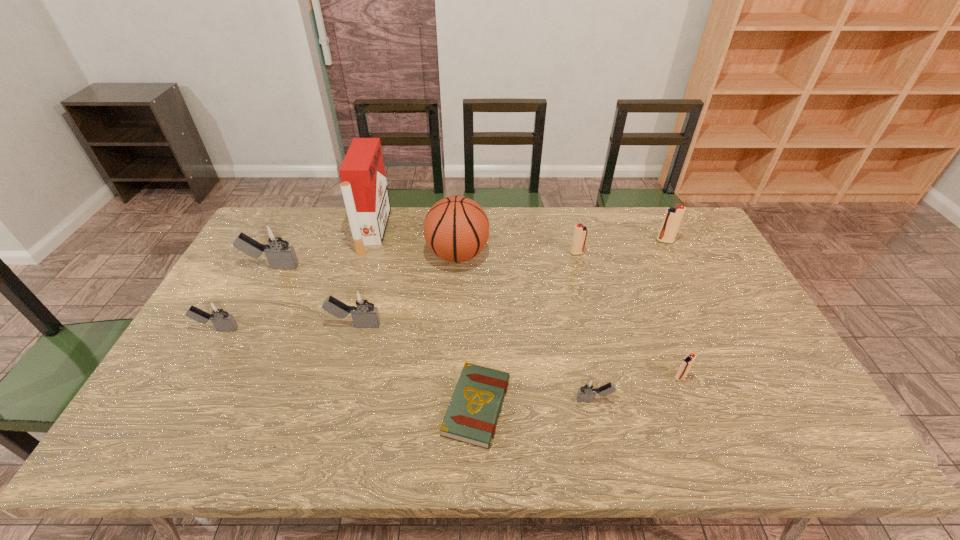
Locate an element on the screen. the third biggest gray igniter is located at coordinates (216, 311).

You are a GUI agent. You are given a task and a screenshot of the screen. Output one action in this format:
    pyautogui.click(x=<x>, y=<y>)
    Task: Click on the second farthest red igniter
    
    Given the screenshot: What is the action you would take?
    pyautogui.click(x=580, y=232)

This screenshot has width=960, height=540. I want to click on the leftmost red igniter, so click(580, 232).

This screenshot has height=540, width=960. In order to click on the ninth object from left to right in this screenshot , I will do `click(687, 362)`.

Identify the location of the second red igniter from left to right. This screenshot has width=960, height=540. (687, 362).

What are the coordinates of `the smallest gray igniter` in the screenshot? It's located at (588, 388).

What are the coordinates of `the rightmost gray igniter` in the screenshot? It's located at (588, 388).

The image size is (960, 540). In order to click on the shortest object in this screenshot , I will do `click(471, 417)`.

The height and width of the screenshot is (540, 960). Find the location of `brown book`. brown book is located at coordinates (471, 417).

I want to click on vacant space located on the front-facing side of the tallest object, so click(x=411, y=231).